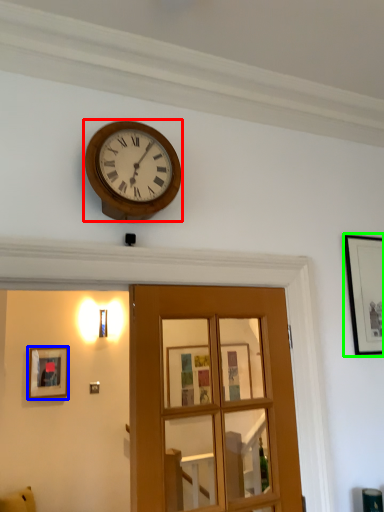
Question: Based on their relative distances, which object is nearer to wall clock (highlighted by a red box)? Choose from picture frame (highlighted by a blue box) and picture frame (highlighted by a green box).

Choices:
 (A) picture frame
 (B) picture frame

Answer: (B)